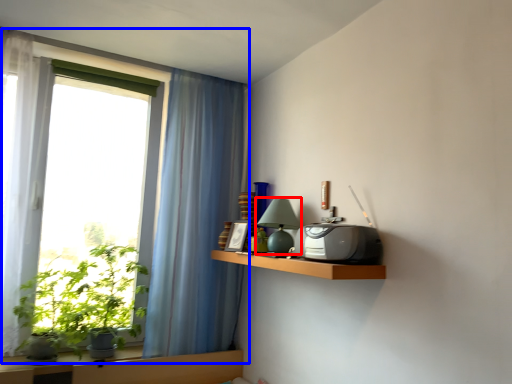
Question: Which object is closer to the camera taking this photo, table lamp (highlighted by a red box) or window (highlighted by a blue box)?

Choices:
 (A) table lamp
 (B) window

Answer: (A)